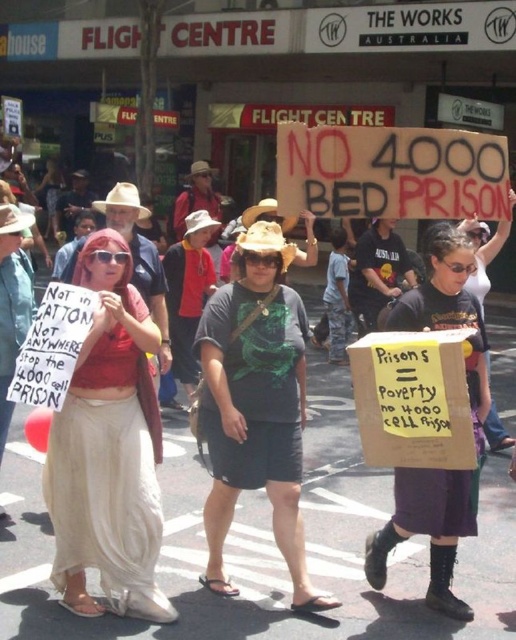
Can you confirm if matte gray t-shirt at center is wider than black cardboard sign at center?

Indeed, matte gray t-shirt at center has a greater width compared to black cardboard sign at center.

Which is more to the left, matte gray t-shirt at center or black cardboard sign at center?

From the viewer's perspective, matte gray t-shirt at center appears more on the left side.

Locate an element on the screen. The height and width of the screenshot is (640, 516). matte gray t-shirt at center is located at coordinates (255, 404).

In the scene shown: Who is positioned more to the left, white cotton skirt at center or matte gray t-shirt at center?

From the viewer's perspective, white cotton skirt at center appears more on the left side.

Between white cotton skirt at center and matte gray t-shirt at center, which one has less height?

Standing shorter between the two is white cotton skirt at center.

Who is more forward, [126,404] or [286,467]?

Point [126,404] is more forward.

Find the location of a particular element. The height and width of the screenshot is (640, 516). white cotton skirt at center is located at coordinates (108, 449).

Can you confirm if white cotton skirt at center is taller than black cardboard sign at center?

No.

Does white cotton skirt at center appear on the left side of black cardboard sign at center?

Indeed, white cotton skirt at center is positioned on the left side of black cardboard sign at center.

This screenshot has height=640, width=516. Describe the element at coordinates (108, 449) in the screenshot. I see `white cotton skirt at center` at that location.

Where is `white cotton skirt at center`? The width and height of the screenshot is (516, 640). white cotton skirt at center is located at coordinates (108, 449).